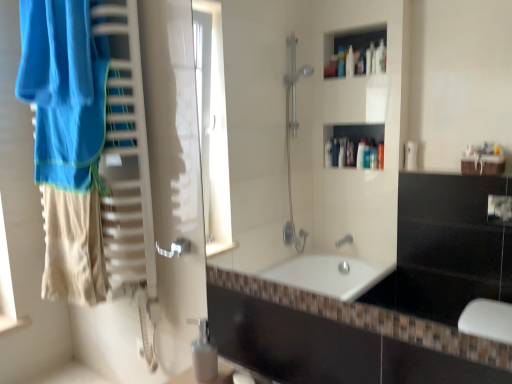
Question: Should I look upward or downward to see white glossy soap dispenser at lower center?

Choices:
 (A) up
 (B) down

Answer: (B)